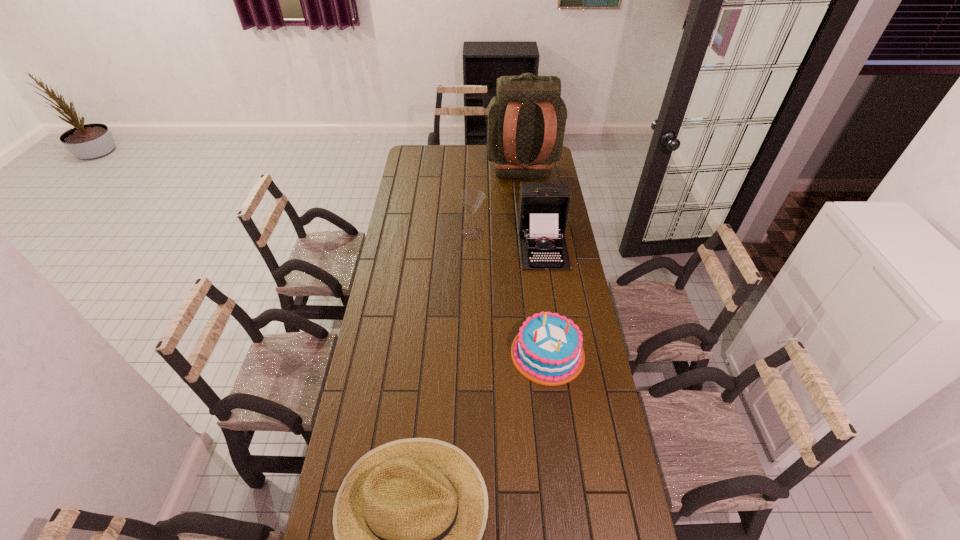
The image size is (960, 540). Find the location of `backpack`. backpack is located at coordinates (526, 121).

Where is `the farthest object`? This screenshot has width=960, height=540. the farthest object is located at coordinates (526, 121).

This screenshot has width=960, height=540. I want to click on typewriter, so click(x=543, y=209).

You are a GUI agent. You are given a task and a screenshot of the screen. Output one action in this format:
    pyautogui.click(x=<x>, y=<y>)
    Task: Click on the flute glass
    The height and width of the screenshot is (540, 960).
    Given the screenshot: What is the action you would take?
    pyautogui.click(x=471, y=198)

In order to click on birthday cake in this screenshot , I will do `click(548, 349)`.

This screenshot has width=960, height=540. What are the coordinates of `vacant space located on the back of the farthest object` in the screenshot? It's located at (530, 246).

The height and width of the screenshot is (540, 960). What are the coordinates of `blank area located 0.230m inside the open case of the typewriter` in the screenshot? It's located at (553, 311).

Where is `free space located on the left of the third tallest object`? free space located on the left of the third tallest object is located at coordinates (402, 234).

You are a GUI agent. You are given a task and a screenshot of the screen. Output one action in this format:
    pyautogui.click(x=<x>, y=<y>)
    Task: Click on the free space located 0.330m on the left of the second nearest object
    Image resolution: width=960 pixels, height=540 pixels.
    Given the screenshot: What is the action you would take?
    pyautogui.click(x=420, y=353)

Where is `object that is at the far edge`? The width and height of the screenshot is (960, 540). object that is at the far edge is located at coordinates (526, 121).